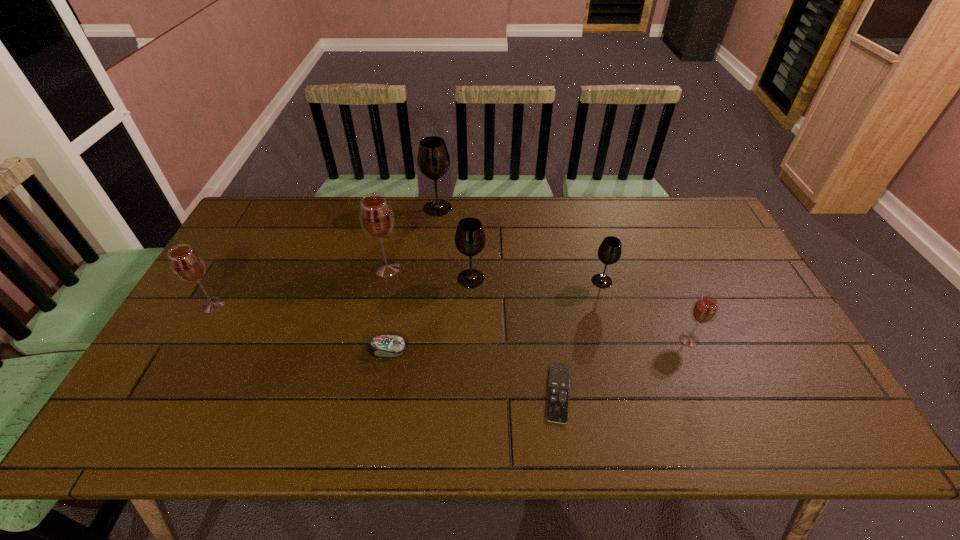
The image size is (960, 540). What are the coordinates of `red wineglass object that ranks as the third closest to the sixth object from left to right` in the screenshot? It's located at (187, 264).